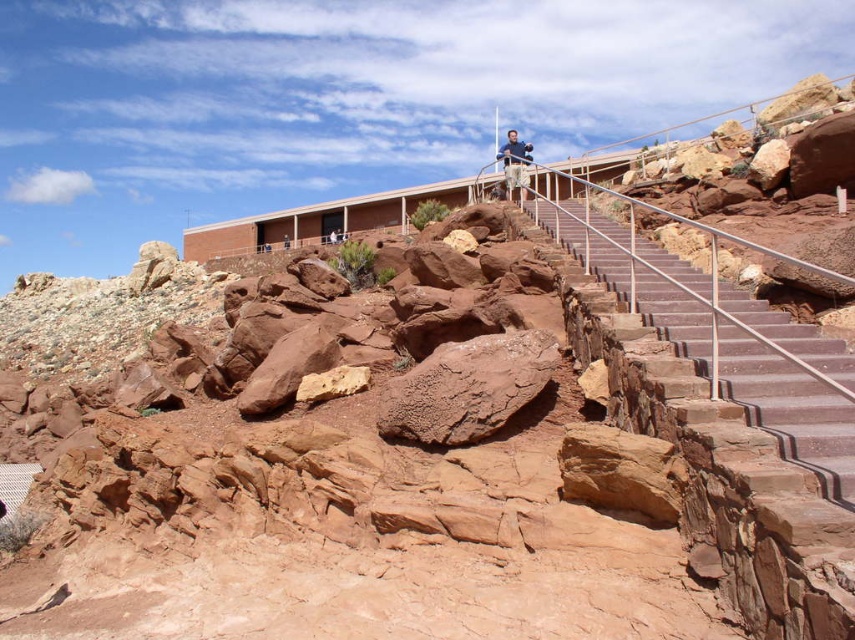
Question: Estimate the real-world distances between objects in this image. Which object is closer to the tan fabric shirt at upper center?

Choices:
 (A) smooth concrete stairs at center
 (B) rusty rock at center

Answer: (A)

Question: Is rusty rock at center positioned in front of tan fabric shirt at upper center?

Choices:
 (A) no
 (B) yes

Answer: (B)

Question: Among these points, which one is nearest to the camera?

Choices:
 (A) (758, 323)
 (B) (517, 388)
 (C) (508, 138)

Answer: (B)

Question: Is rusty rock at center to the right of tan fabric shirt at upper center from the viewer's perspective?

Choices:
 (A) no
 (B) yes

Answer: (A)

Question: Which of the following is the closest to the observer?

Choices:
 (A) [x=494, y=349]
 (B) [x=758, y=378]

Answer: (B)

Question: Is rusty rock at center below tan fabric shirt at upper center?

Choices:
 (A) no
 (B) yes

Answer: (B)